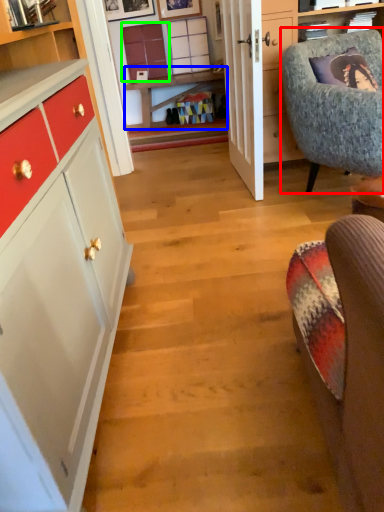
Question: Which is farther away from chair (highlighted by a red box)? table (highlighted by a blue box) or cabinetry (highlighted by a green box)?

Choices:
 (A) table
 (B) cabinetry

Answer: (B)